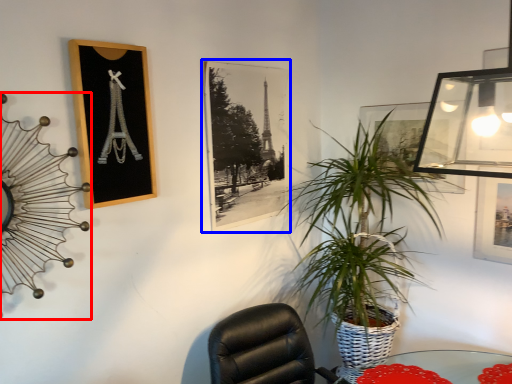
Question: Among these objects, which one is farthest to the camera, clock (highlighted by a red box) or picture frame (highlighted by a blue box)?

Choices:
 (A) clock
 (B) picture frame

Answer: (B)